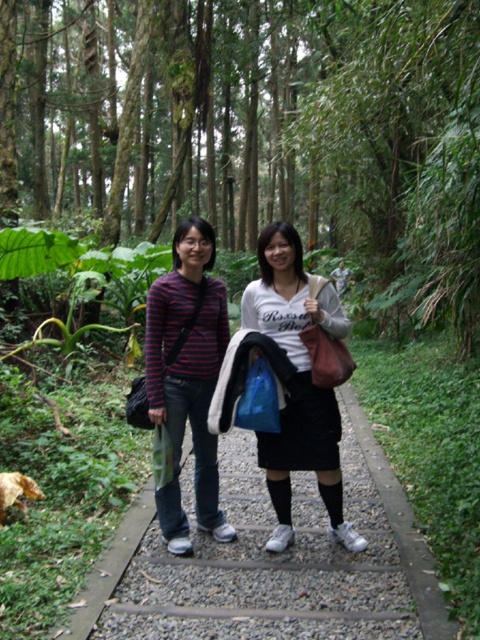
Does striped cotton shirt at center have a smaller size compared to white matte skirt at center?

Indeed, striped cotton shirt at center has a smaller size compared to white matte skirt at center.

Is point (188, 545) farther from viewer compared to point (299, 349)?

Yes, point (188, 545) is farther from viewer.

This screenshot has height=640, width=480. I want to click on striped cotton shirt at center, so click(x=188, y=378).

Who is taller, green leafy tree at center or striped cotton shirt at center?

With more height is green leafy tree at center.

Does green leafy tree at center appear over striped cotton shirt at center?

Indeed, green leafy tree at center is positioned over striped cotton shirt at center.

Is point (264, 22) closer to viewer compared to point (183, 550)?

No.

This screenshot has height=640, width=480. What are the coordinates of `green leafy tree at center` in the screenshot? It's located at (254, 132).

Which is more to the left, green leafy tree at center or white matte skirt at center?

green leafy tree at center is more to the left.

Between point (343, 1) and point (277, 540), which one is positioned behind?

The point (343, 1) is more distant.

Describe the element at coordinates (254, 132) in the screenshot. I see `green leafy tree at center` at that location.

You are a GUI agent. You are given a task and a screenshot of the screen. Output one action in this format:
    pyautogui.click(x=<x>, y=<y>)
    Task: Click on the green leafy tree at center
    
    Given the screenshot: What is the action you would take?
    pyautogui.click(x=254, y=132)